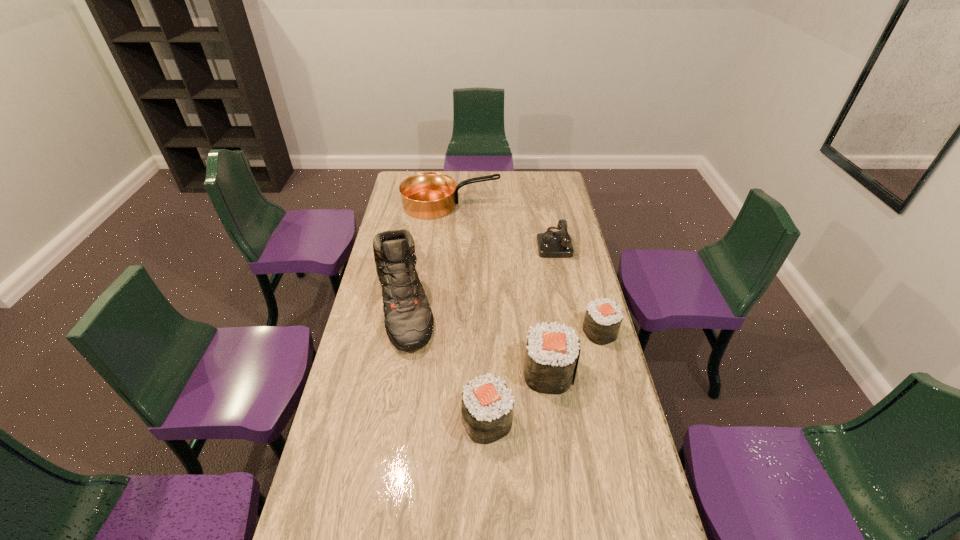
In the current image, all sushis are evenly spaced. To maintain this equal spacing, where should an additional sushi be placed on the left? Please point out a free spot. Please provide its 2D coordinates. Your answer should be formatted as a tuple, i.e. [(x, y)], where the tuple contains the x and y coordinates of a point satisfying the conditions above.

[(413, 480)]